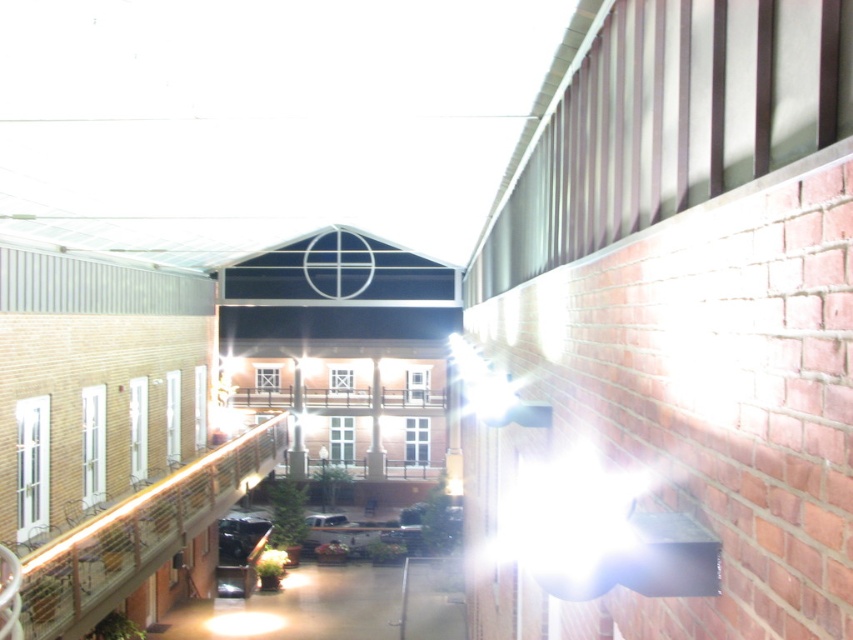
Question: Does shiny black car at lower left appear under metallic silver car at center?

Choices:
 (A) no
 (B) yes

Answer: (B)

Question: Does shiny black car at lower left lie in front of metallic silver car at center?

Choices:
 (A) no
 (B) yes

Answer: (B)

Question: Is shiny black car at lower left positioned in front of metallic silver car at center?

Choices:
 (A) yes
 (B) no

Answer: (A)